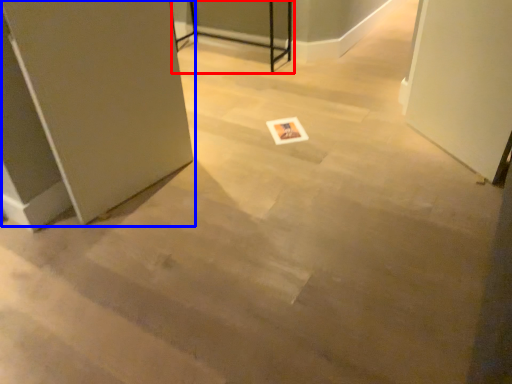
Question: Which of the following is the closest to the observer, table (highlighted by a red box) or door (highlighted by a blue box)?

Choices:
 (A) table
 (B) door

Answer: (B)